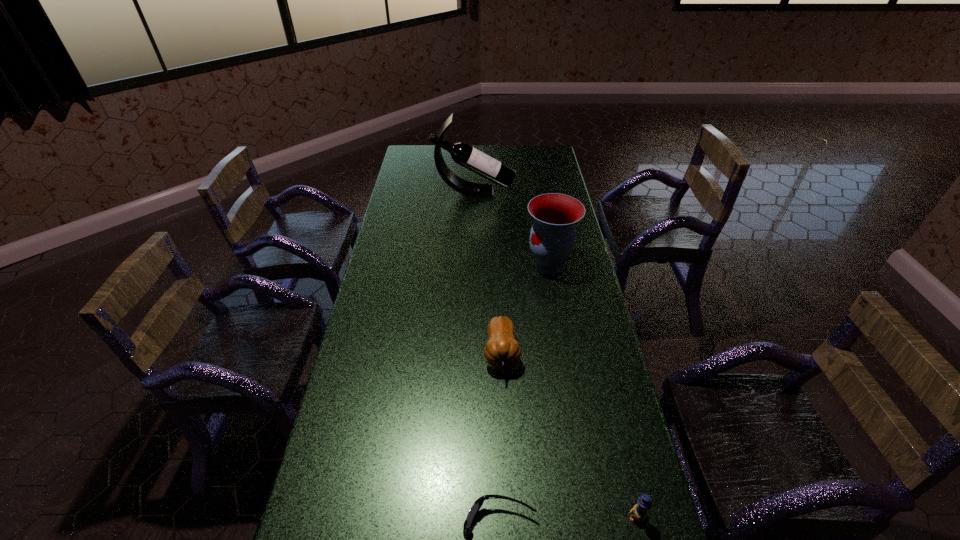
Where is `object identified as the third closest to the gourd`? The image size is (960, 540). object identified as the third closest to the gourd is located at coordinates (639, 512).

You are a GUI agent. You are given a task and a screenshot of the screen. Output one action in this format:
    pyautogui.click(x=<x>, y=<y>)
    Task: Click on the third closest object relative to the third nearest object
    
    Given the screenshot: What is the action you would take?
    pyautogui.click(x=639, y=512)

Locate an element on the screen. free space that satisfies the following two spatial constraints: 1. on the stand of the tallest object; 2. on the back side of the vase is located at coordinates (472, 266).